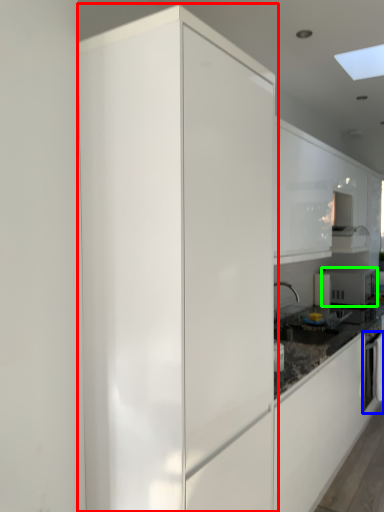
Question: Which object is the farthest from cabinetry (highlighted by a red box)? Choose among these: oven (highlighted by a blue box) or home appliance (highlighted by a green box).

Choices:
 (A) oven
 (B) home appliance

Answer: (B)